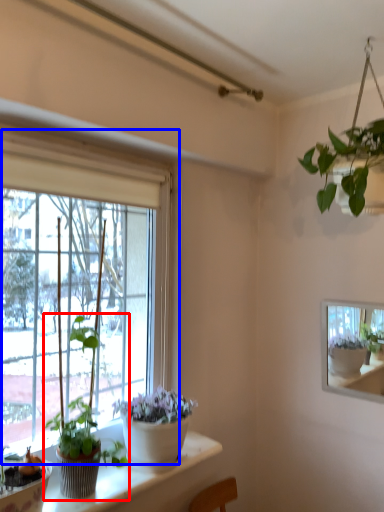
Question: Which object is further to the camera taking this photo, houseplant (highlighted by a red box) or window (highlighted by a blue box)?

Choices:
 (A) houseplant
 (B) window

Answer: (A)